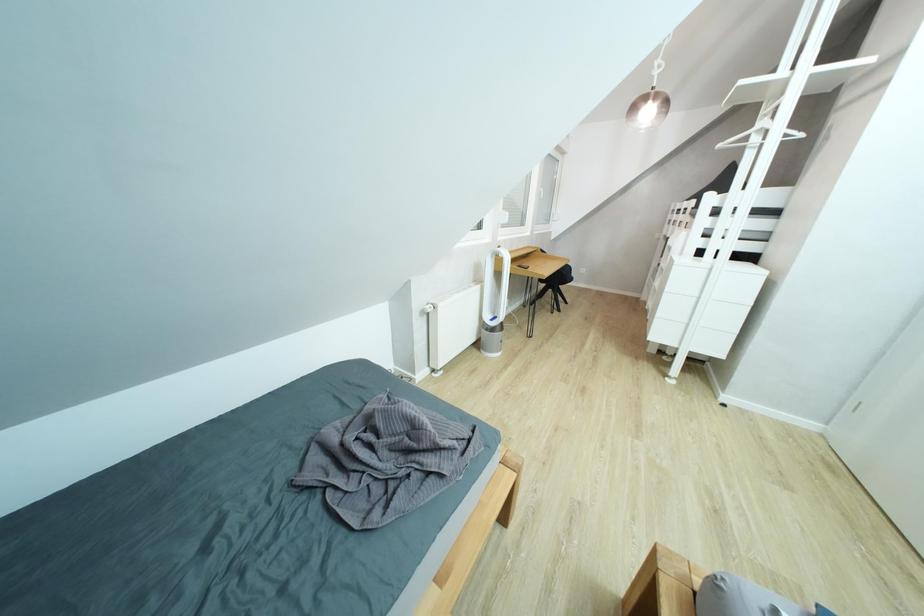
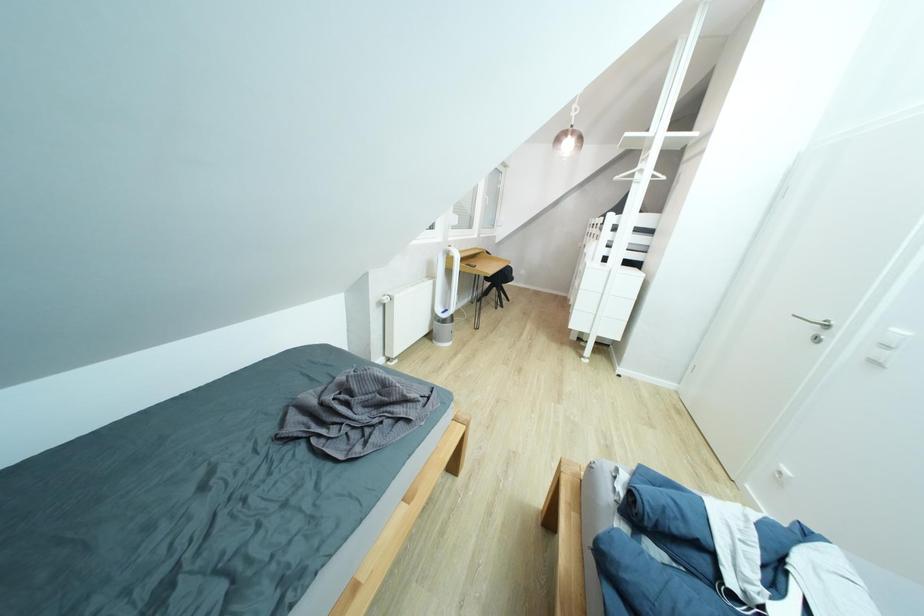
Question: Which direction would the cameraman need to move to produce the second image? Reply with the corresponding letter.

Choices:
 (A) Left
 (B) Right
 (C) Forward
 (D) Backward

Answer: (D)